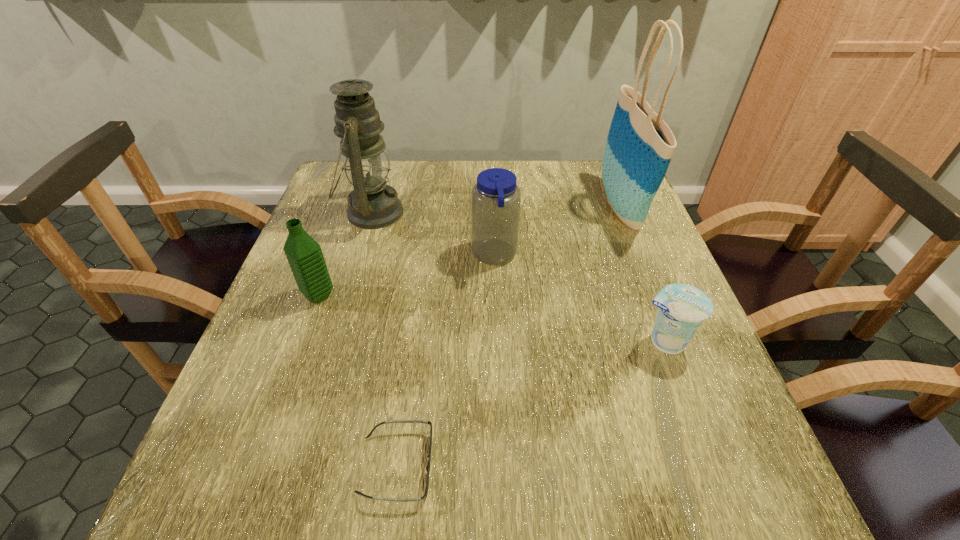
Identify the location of vacant region at the far left corner of the desktop. The image size is (960, 540). (338, 188).

Find the location of a particular element. The width and height of the screenshot is (960, 540). vacant area at the near left corner is located at coordinates (215, 493).

Locate an element on the screen. This screenshot has height=540, width=960. free region at the far right corner of the desktop is located at coordinates (584, 201).

The height and width of the screenshot is (540, 960). I want to click on vacant space in between the tote bag and the third object from right to left, so click(x=558, y=231).

Image resolution: width=960 pixels, height=540 pixels. What are the coordinates of `free area in between the yogurt and the shortest object` in the screenshot? It's located at tap(530, 403).

At what (x,y) coordinates should I click in order to perform the action: click on vacant space in between the fifth shortest object and the yogurt. Please return your answer as a coordinate pair (x, y). Looking at the image, I should click on (518, 277).

Locate an element on the screen. This screenshot has height=540, width=960. free spot between the yogurt and the sunglasses is located at coordinates (530, 403).

Locate an element on the screen. The height and width of the screenshot is (540, 960). unoccupied position between the farther water bottle and the second tallest object is located at coordinates (434, 234).

Where is `free space between the left water bottle and the tote bag`? The image size is (960, 540). free space between the left water bottle and the tote bag is located at coordinates (469, 251).

Locate an element on the screen. The width and height of the screenshot is (960, 540). vacant point located between the left water bottle and the tote bag is located at coordinates (469, 251).